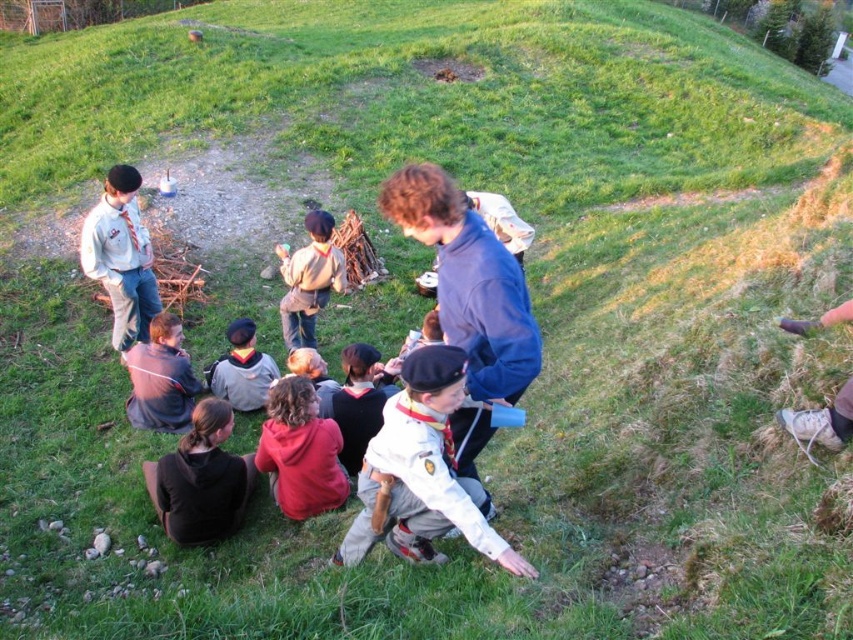
Can you confirm if white cotton shirt at lower center is wider than dark gray fleece jacket at lower left?

Indeed, white cotton shirt at lower center has a greater width compared to dark gray fleece jacket at lower left.

Who is higher up, white cotton shirt at lower center or dark gray fleece jacket at lower left?

dark gray fleece jacket at lower left

Who is more forward, [442,560] or [160,371]?

Positioned in front is point [442,560].

Image resolution: width=853 pixels, height=640 pixels. I want to click on white cotton shirt at lower center, so click(422, 472).

Can you confirm if white shirt at upper left is positioned below dark gray fleece jacket at lower left?

No.

What do you see at coordinates (120, 257) in the screenshot? Image resolution: width=853 pixels, height=640 pixels. I see `white shirt at upper left` at bounding box center [120, 257].

Between point (109, 195) and point (164, 388), which one is positioned behind?

The point (109, 195) is more distant.

Locate an element on the screen. The image size is (853, 640). white shirt at upper left is located at coordinates (120, 257).

Is red fleece jacket at lower center bigger than dark gray sweater at center?

Yes.

Between red fleece jacket at lower center and dark gray sweater at center, which one is positioned lower?

Positioned lower is red fleece jacket at lower center.

Find the location of a particular element. Image resolution: width=853 pixels, height=640 pixels. red fleece jacket at lower center is located at coordinates (300, 451).